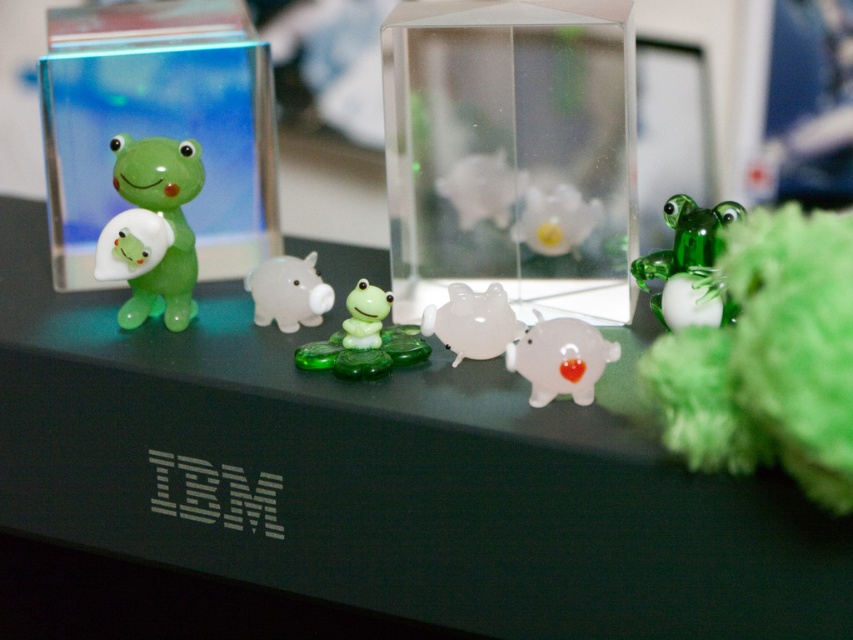
You are setting up a display and need to place the transparent glass table at center and the green glass frog at right. Considering their heights, which object should be placed lower to ensure stability?

The green glass frog at right should be placed lower since the transparent glass table at center is taller, so positioning the frog lower would help maintain stability by balancing the heights appropriately.

You are designing a storage box for these piggy banks. The transparent glass piggy bank at center is smaller in width than the translucent white piggy bank at center. Which piggy bank requires a wider storage box?

The translucent white piggy bank at center requires a wider storage box because its width is greater than the transparent glass piggy bank at center.